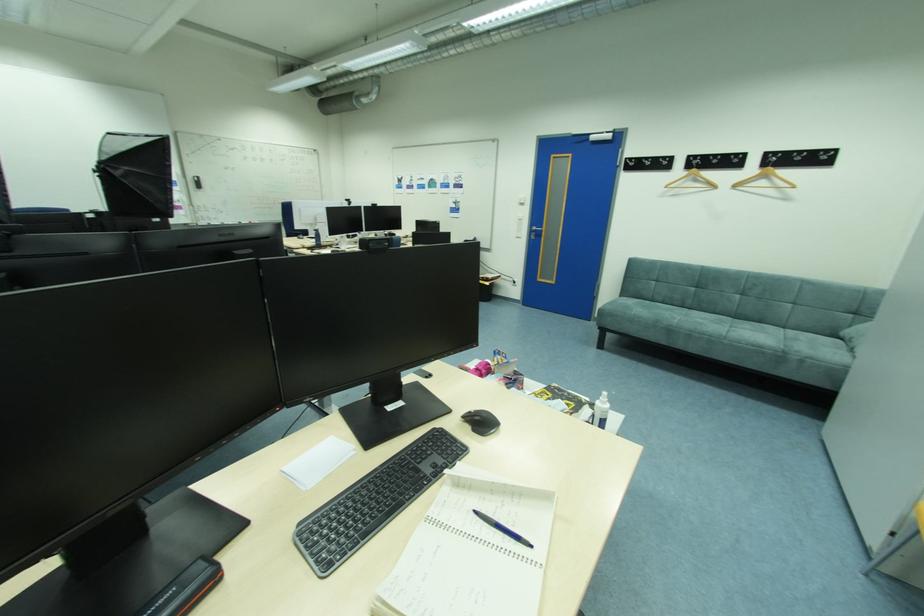
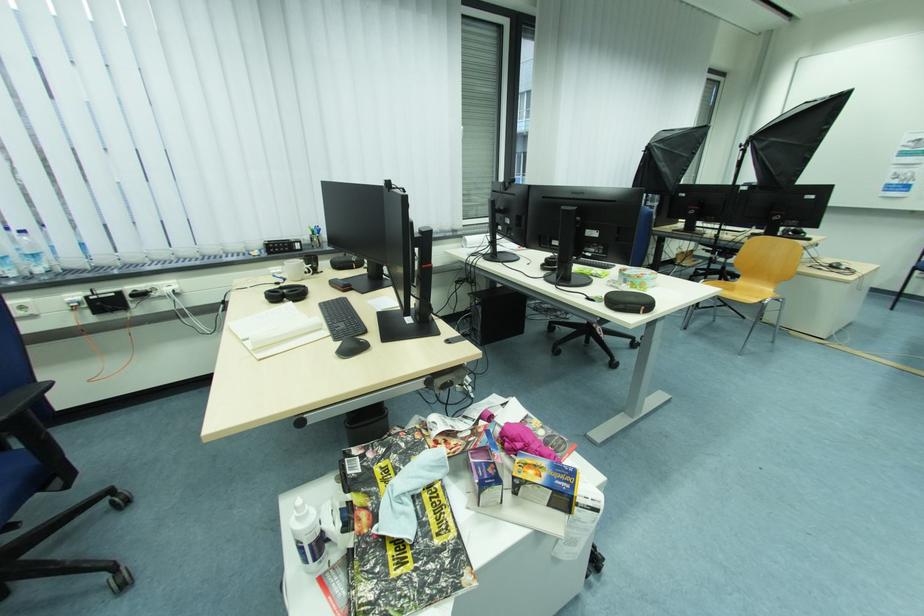
The point at (553, 398) is marked in the first image. Where is the corresponding point in the second image?

(442, 530)